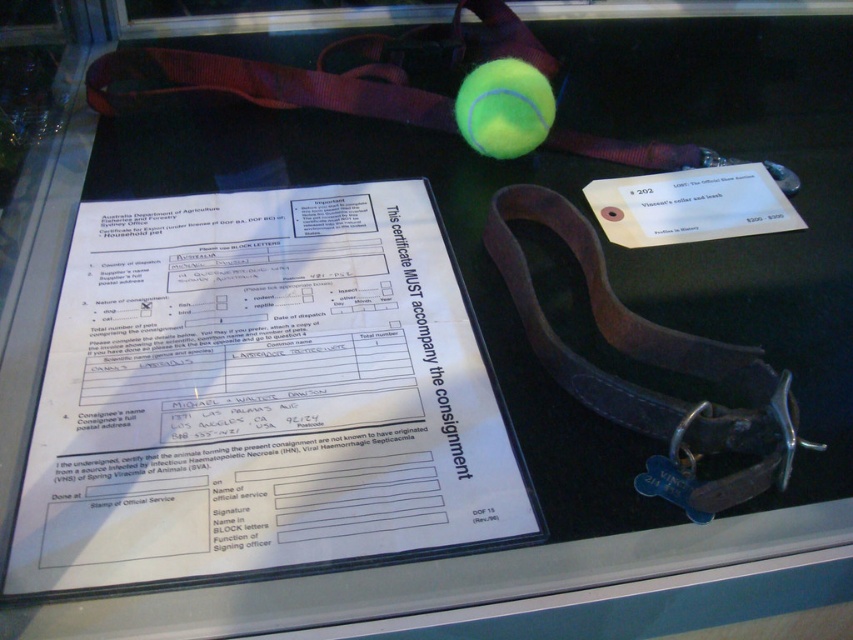
You are a customer in a pet store looking at a display case. The case has a document on the left and a brown leather dog collar with a blue tag on the right. There is also a point marked at coordinates (650,364). Where is this point located in relation to the items in the display case?

The point at coordinates (650,364) is located on the brown leather collar at center.

You are a delivery person who needs to measure the distance between the document and the camera. The document is located at point (486, 252). Can you confirm the distance?

The distance between point (486, 252) and the camera is 37.10 inches.

You are a veterinarian examining the items in the display case. You need to determine which item has a greater width between the brown leather collar at center and the green rubber tennis ball at upper center. Which one is wider?

The brown leather collar at center has a larger width than the green rubber tennis ball at upper center.